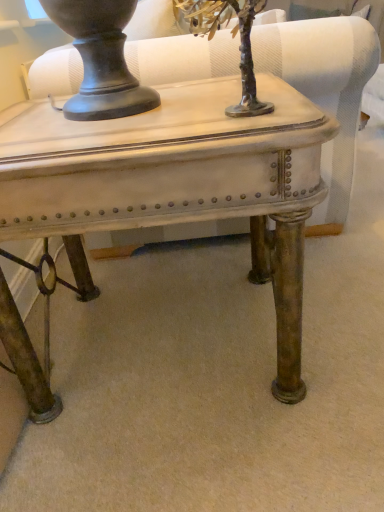
Question: Considering the relative sizes of metallic silver tree at upper center and matte white table at center in the image provided, is metallic silver tree at upper center wider than matte white table at center?

Choices:
 (A) no
 (B) yes

Answer: (A)

Question: From a real-world perspective, is metallic silver tree at upper center beneath matte white table at center?

Choices:
 (A) no
 (B) yes

Answer: (A)

Question: Is metallic silver tree at upper center far from matte white table at center?

Choices:
 (A) yes
 (B) no

Answer: (B)

Question: Is metallic silver tree at upper center to the right of matte white table at center from the viewer's perspective?

Choices:
 (A) yes
 (B) no

Answer: (A)

Question: Can you confirm if metallic silver tree at upper center is thinner than matte white table at center?

Choices:
 (A) no
 (B) yes

Answer: (B)

Question: Would you say matte white swivel chair at center is to the left or to the right of matte white table at center in the picture?

Choices:
 (A) left
 (B) right

Answer: (B)

Question: Is matte white swivel chair at center spatially inside matte white table at center, or outside of it?

Choices:
 (A) inside
 (B) outside

Answer: (B)

Question: Considering their positions, is matte white swivel chair at center located in front of or behind matte white table at center?

Choices:
 (A) front
 (B) behind

Answer: (B)

Question: In terms of height, does matte white swivel chair at center look taller or shorter compared to matte white table at center?

Choices:
 (A) tall
 (B) short

Answer: (A)

Question: Do you think metallic silver tree at upper center is within matte white swivel chair at center, or outside of it?

Choices:
 (A) outside
 (B) inside

Answer: (A)

Question: Would you say metallic silver tree at upper center is to the left or to the right of matte white swivel chair at center in the picture?

Choices:
 (A) left
 (B) right

Answer: (B)

Question: In terms of height, does metallic silver tree at upper center look taller or shorter compared to matte white swivel chair at center?

Choices:
 (A) tall
 (B) short

Answer: (B)

Question: Is point (211, 12) positioned closer to the camera than point (327, 42)?

Choices:
 (A) farther
 (B) closer

Answer: (B)

Question: From a real-world perspective, is matte white swivel chair at center physically located above or below metallic silver tree at upper center?

Choices:
 (A) above
 (B) below

Answer: (B)

Question: Is matte white swivel chair at center situated inside metallic silver tree at upper center or outside?

Choices:
 (A) inside
 (B) outside

Answer: (B)